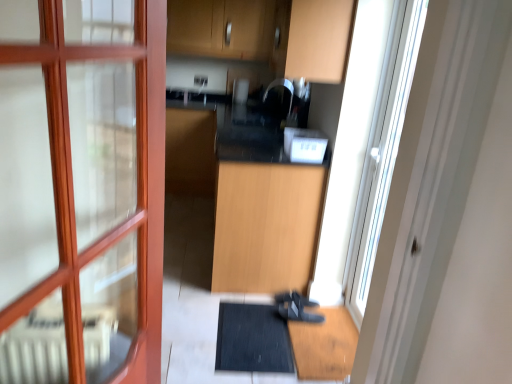
Question: Does point click(260, 354) appear closer or farther from the camera than point click(345, 56)?

Choices:
 (A) closer
 (B) farther

Answer: (A)

Question: From a real-world perspective, is black rubber bath mat at lower center physically located above or below wooden cabinet at upper center, acting as the first cabinetry starting from the top?

Choices:
 (A) above
 (B) below

Answer: (B)

Question: Based on their relative distances, which object is nearer to the white plastic toaster at center?

Choices:
 (A) light wood cabinet at center, which is the second cabinetry from top to bottom
 (B) transparent glass screen door at right
 (C) wooden cabinet at upper center, acting as the first cabinetry starting from the top
 (D) black matte shoe at lower center
 (E) black rubber bath mat at lower center

Answer: (A)

Question: Considering the real-world distances, which object is farthest from the white plastic toaster at center?

Choices:
 (A) black matte shoe at lower center
 (B) transparent glass screen door at right
 (C) wooden cabinet at upper center, acting as the first cabinetry starting from the top
 (D) black rubber bath mat at lower center
 (E) light wood cabinet at center, the first cabinetry when ordered from bottom to top

Answer: (B)